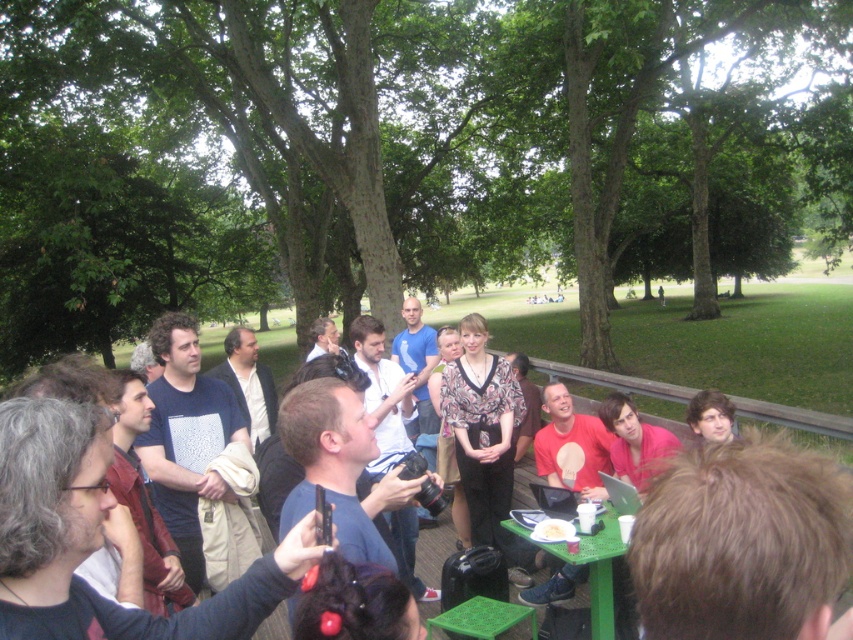
Question: Is green plastic table at center positioned behind white paper plate at center?

Choices:
 (A) yes
 (B) no

Answer: (B)

Question: Which object is farther from the camera taking this photo?

Choices:
 (A) green plastic table at center
 (B) white paper plate at center

Answer: (B)

Question: Does green plastic table at center appear on the left side of white paper plate at center?

Choices:
 (A) no
 (B) yes

Answer: (A)

Question: Which point appears farthest from the camera in this image?

Choices:
 (A) (607, 570)
 (B) (555, 531)

Answer: (B)

Question: Is green plastic table at center positioned behind white paper plate at center?

Choices:
 (A) yes
 (B) no

Answer: (B)